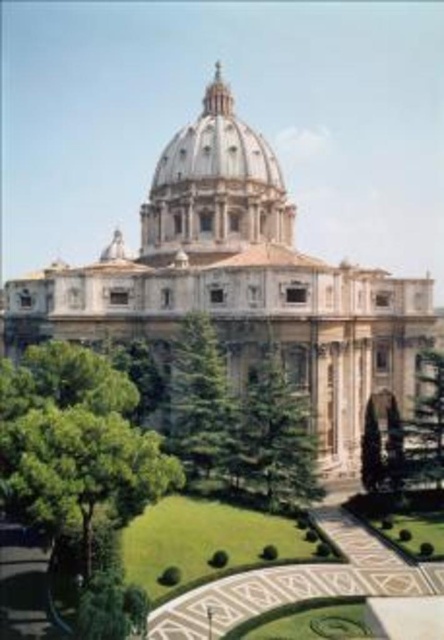
You are standing in front of the grand dome structure and want to determine the relative positions of two points in the scene. The first point is located at coordinates point (x=3, y=378), and the second point is at point (x=194, y=138). Based on the scene description, which point is closer to you?

Point (x=3, y=378) is closer to the viewer than point (x=194, y=138).

You are standing in the garden area of the grand structure. You see the green leafy tree at lower left and the green textured tree at center. Which tree is closer to you?

The green leafy tree at lower left is positioned under the green textured tree at center, meaning it is closer to you.